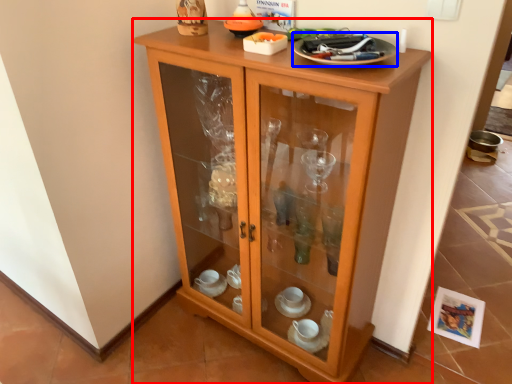
Question: Which object appears farthest to the camera in this image, cupboard (highlighted by a red box) or tableware (highlighted by a blue box)?

Choices:
 (A) cupboard
 (B) tableware

Answer: (B)